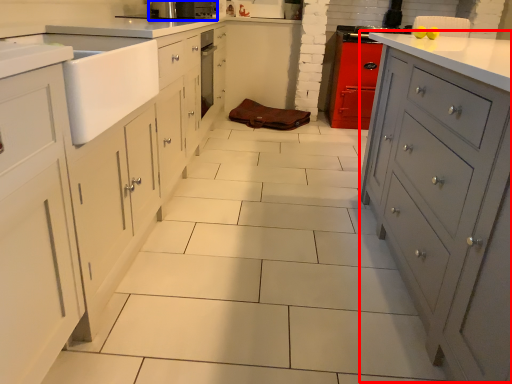
Question: Which object is further to the camera taking this photo, file cabinet (highlighted by a red box) or home appliance (highlighted by a blue box)?

Choices:
 (A) file cabinet
 (B) home appliance

Answer: (B)